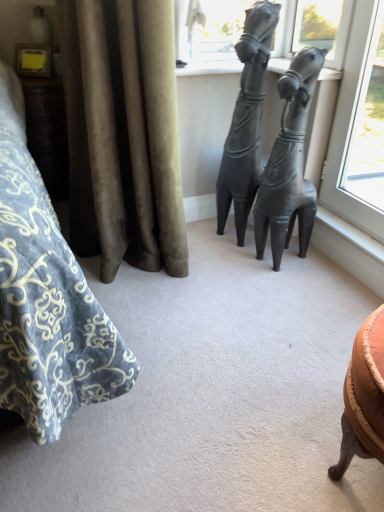
The image size is (384, 512). In order to click on vacant area that lies in front of matte black statue at center, the first statue (sculpture) in the left-to-right sequence in this screenshot , I will do `click(231, 260)`.